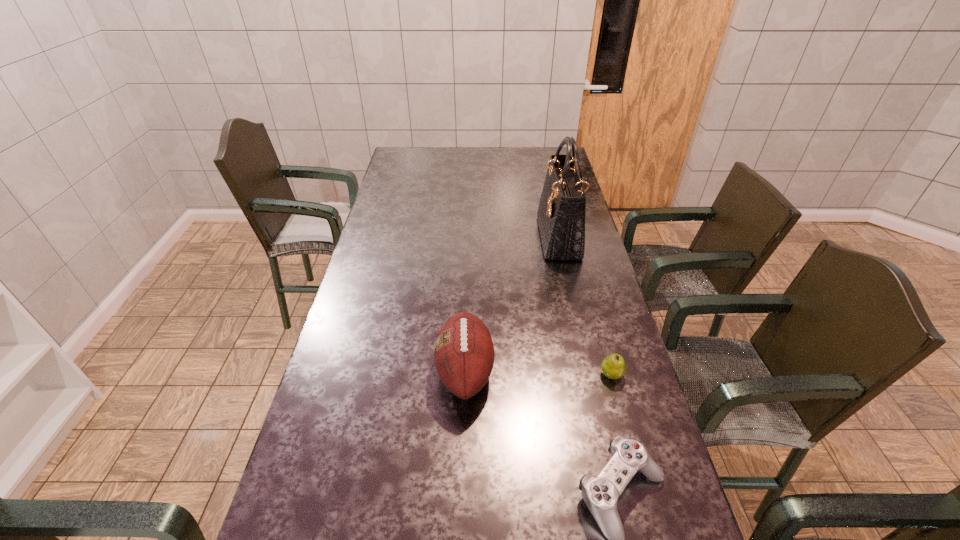
Find the location of a particular element. The image size is (960, 540). handbag is located at coordinates (561, 213).

This screenshot has width=960, height=540. What are the coordinates of `the farthest object` in the screenshot? It's located at (561, 213).

You are a GUI agent. You are given a task and a screenshot of the screen. Output one action in this format:
    pyautogui.click(x=<x>, y=<y>)
    Task: Click on the football (American)
    The width and height of the screenshot is (960, 540).
    Given the screenshot: What is the action you would take?
    pyautogui.click(x=464, y=353)

The width and height of the screenshot is (960, 540). In order to click on the third shortest object in this screenshot , I will do point(464,353).

Locate an element on the screen. This screenshot has width=960, height=540. the second shortest object is located at coordinates (613, 366).

The image size is (960, 540). Find the location of `free spot located 0.270m at the front of the tallest object with visible charms`. free spot located 0.270m at the front of the tallest object with visible charms is located at coordinates coord(469,238).

The width and height of the screenshot is (960, 540). I want to click on vacant space situated 0.260m at the front of the tallest object with visible charms, so coord(471,238).

At what (x,y) coordinates should I click in order to perform the action: click on free region located 0.350m at the front of the tallest object with visible charms. Please return your answer as a coordinate pair (x, y). The height and width of the screenshot is (540, 960). Looking at the image, I should click on (448, 238).

Find the location of a particular element. Image resolution: width=960 pixels, height=540 pixels. blank space located 0.280m on the front of the football (American) is located at coordinates [x=460, y=539].

Locate an element on the screen. vacant position located 0.310m on the back of the pear is located at coordinates (588, 289).